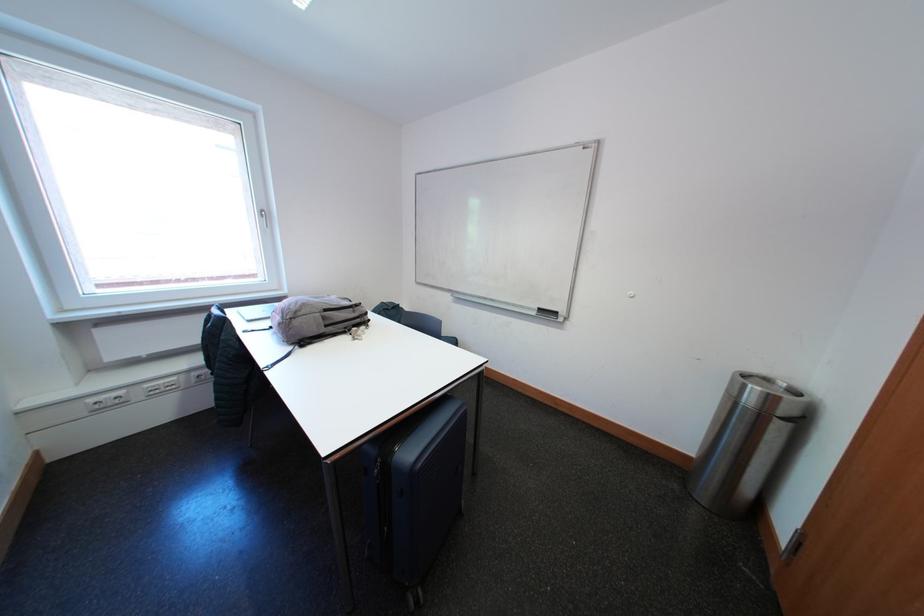
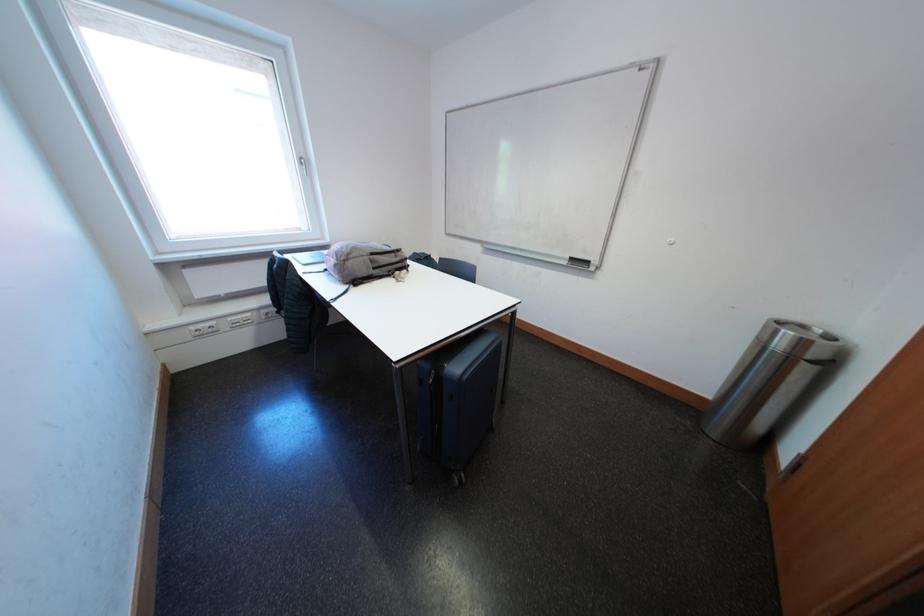
Locate, in the second image, the point that corresponds to pixel 156 389 in the first image.

(238, 322)